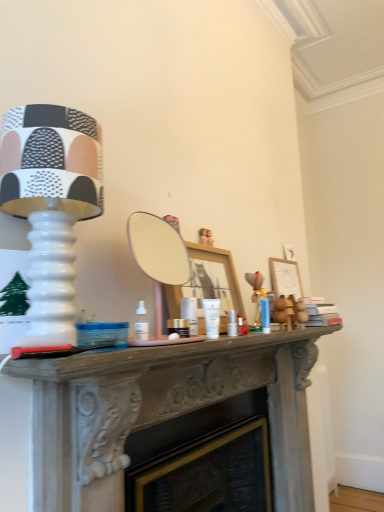
Question: Is white glossy cream at center bigger or smaller than wooden picture frame at right?

Choices:
 (A) small
 (B) big

Answer: (A)

Question: Considering their positions, is white glossy cream at center located in front of or behind wooden picture frame at right?

Choices:
 (A) behind
 (B) front

Answer: (B)

Question: Which object is the closest to the white glossy cream at center?

Choices:
 (A) wooden picture frame at right
 (B) smooth gray mantelpiece at center
 (C) matte white lamp at left

Answer: (B)

Question: Estimate the real-world distances between objects in this image. Which object is farther from the matte white lamp at left?

Choices:
 (A) white glossy cream at center
 (B) smooth gray mantelpiece at center
 (C) wooden picture frame at right

Answer: (C)